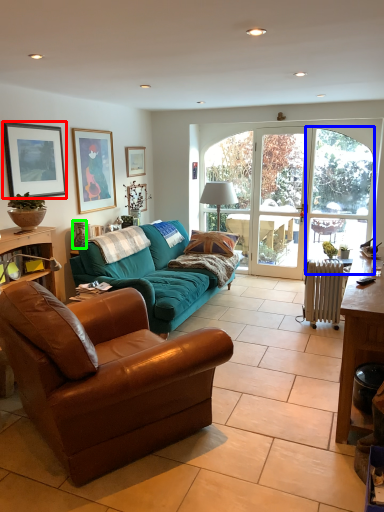
Question: Based on their relative distances, which object is nearer to picture frame (highlighted by a red box)? Choose from window screen (highlighted by a blue box) and vase (highlighted by a green box).

Choices:
 (A) window screen
 (B) vase

Answer: (B)